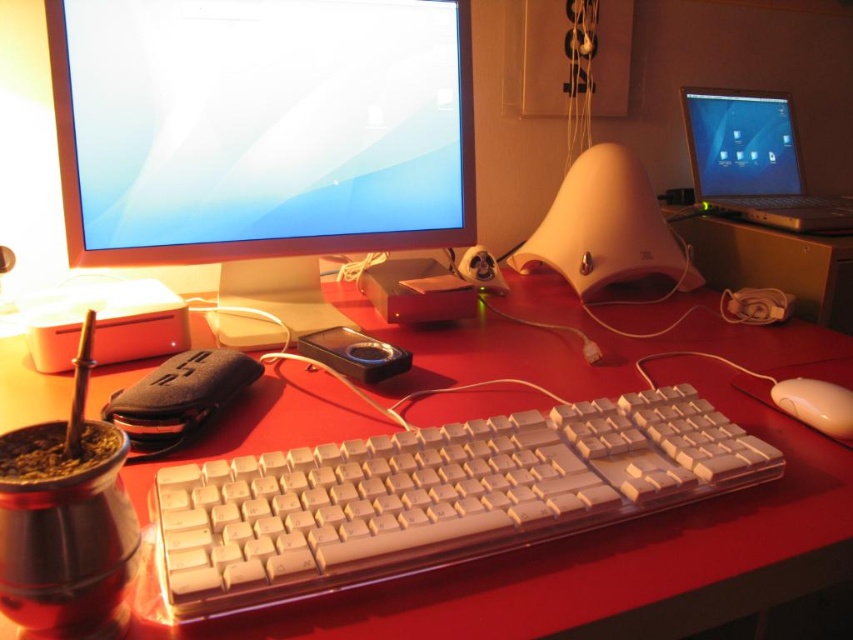
Who is positioned more to the left, red plastic keyboard at center or metallic silver laptop at upper right?

red plastic keyboard at center is more to the left.

What do you see at coordinates (592, 552) in the screenshot? I see `red plastic keyboard at center` at bounding box center [592, 552].

Image resolution: width=853 pixels, height=640 pixels. What are the coordinates of `red plastic keyboard at center` in the screenshot? It's located at (592, 552).

Based on the photo, how far apart are red plastic keyboard at center and beige plastic mouse at lower right?

red plastic keyboard at center and beige plastic mouse at lower right are 11.52 inches apart from each other.

Who is higher up, red plastic keyboard at center or beige plastic mouse at lower right?

red plastic keyboard at center

Is point (809, 496) farther from viewer compared to point (817, 426)?

No, it is not.

Where is `red plastic keyboard at center`? Image resolution: width=853 pixels, height=640 pixels. red plastic keyboard at center is located at coordinates (592, 552).

Between point (750, 218) and point (802, 388), which one is positioned in front?

Point (802, 388) is in front.

Between point (790, 198) and point (845, 435), which one is positioned in front?

Positioned in front is point (845, 435).

This screenshot has width=853, height=640. Find the location of `metallic silver laptop at upper right`. metallic silver laptop at upper right is located at coordinates (753, 161).